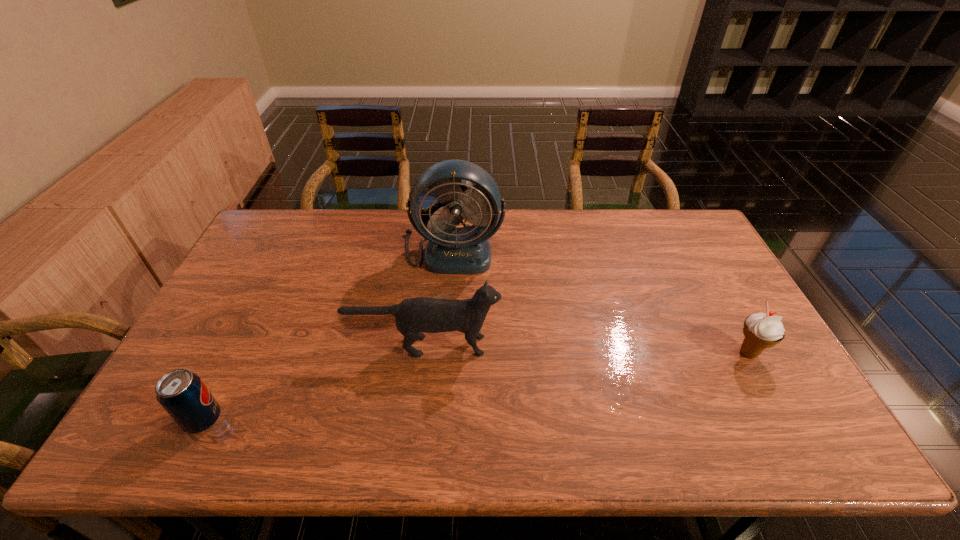
This screenshot has height=540, width=960. Identify the location of empty space that is in between the leftmost object and the farthest object. tap(328, 335).

Image resolution: width=960 pixels, height=540 pixels. Find the location of `object that ranks as the closest to the leftmost object`. object that ranks as the closest to the leftmost object is located at coordinates (422, 314).

At what (x,y) coordinates should I click in order to perform the action: click on object that stands as the third closest to the third shortest object. Please return your answer as a coordinate pair (x, y). Image resolution: width=960 pixels, height=540 pixels. Looking at the image, I should click on (761, 330).

This screenshot has width=960, height=540. I want to click on vacant region that satisfies the following two spatial constraints: 1. on the front-facing side of the cat; 2. on the left side of the icecream, so click(x=422, y=353).

Image resolution: width=960 pixels, height=540 pixels. In order to click on vacant space that satisfies the following two spatial constraints: 1. on the front-facing side of the third shortest object; 2. on the front side of the nearest object in this screenshot , I will do `click(415, 420)`.

The height and width of the screenshot is (540, 960). I want to click on vacant region that satisfies the following two spatial constraints: 1. in front of the tallest object to blow air; 2. on the front-facing side of the cat, so click(x=446, y=346).

Image resolution: width=960 pixels, height=540 pixels. I want to click on vacant area that satisfies the following two spatial constraints: 1. on the back side of the rightmost object; 2. on the right side of the soda can, so pyautogui.click(x=236, y=353).

At what (x,y) coordinates should I click in order to perform the action: click on free space that satisfies the following two spatial constraints: 1. in front of the tallest object to blow air; 2. on the front-facing side of the second tallest object. Please return your answer as a coordinate pair (x, y). The image size is (960, 540). Looking at the image, I should click on (446, 346).